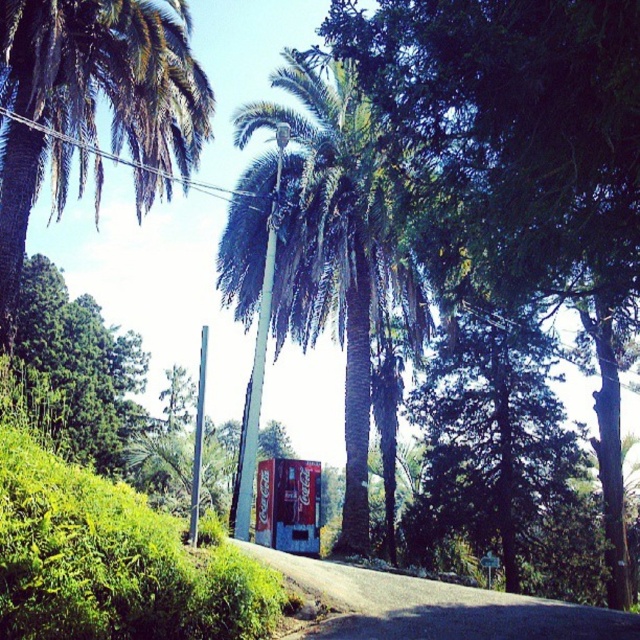
In the scene shown: Who is higher up, green leafy palm tree at center or green leafy palm tree at upper left?

green leafy palm tree at upper left is higher up.

The width and height of the screenshot is (640, 640). Describe the element at coordinates (337, 248) in the screenshot. I see `green leafy palm tree at center` at that location.

Who is more forward, (364, 152) or (51, 141)?

Positioned in front is point (364, 152).

What are the coordinates of `green leafy palm tree at center` in the screenshot? It's located at (337, 248).